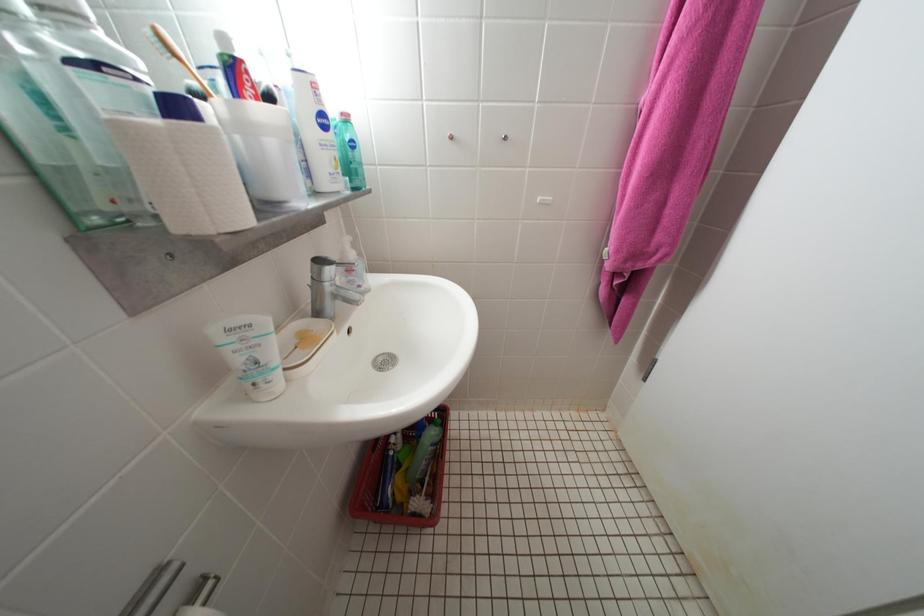
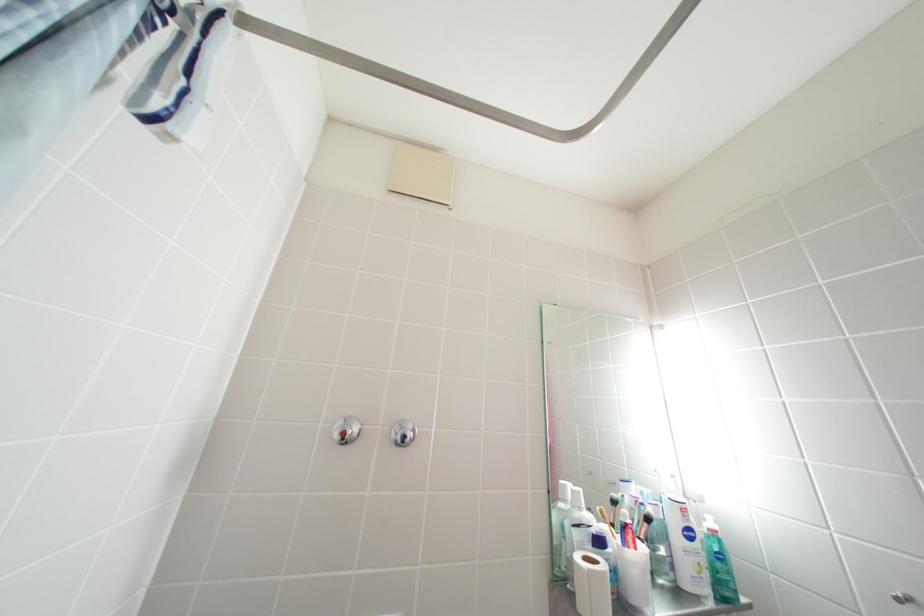
The images are taken continuously from a first-person perspective. In which direction is your viewpoint rotating?

The camera's rotation is toward left-up.